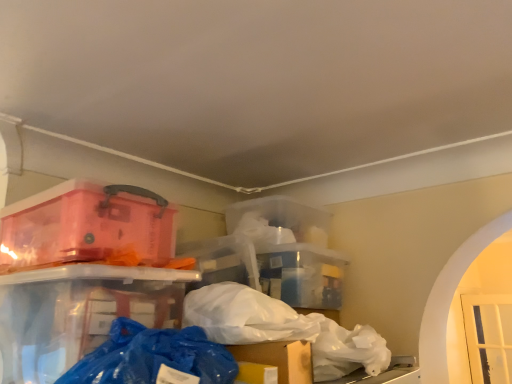
Question: Would you say white matte plastic bag at center, placed as the 1th plastic bag when sorted from back to front, is inside or outside blue plastic bag at lower center, positioned as the first plastic bag in left-to-right order?

Choices:
 (A) outside
 (B) inside

Answer: (A)

Question: Is white matte plastic bag at center, the first plastic bag viewed from the right, taller or shorter than blue plastic bag at lower center, the second plastic bag from the back?

Choices:
 (A) short
 (B) tall

Answer: (B)

Question: Which object is the farthest from the white matte plastic bag at center, the second plastic bag from the left?

Choices:
 (A) blue plastic bag at lower center, acting as the second plastic bag starting from the right
 (B) transparent plastic container at upper left

Answer: (B)

Question: Based on their relative distances, which object is farther from the white matte plastic bag at center, the first plastic bag viewed from the right?

Choices:
 (A) blue plastic bag at lower center, the second plastic bag from the back
 (B) transparent plastic container at upper left

Answer: (B)